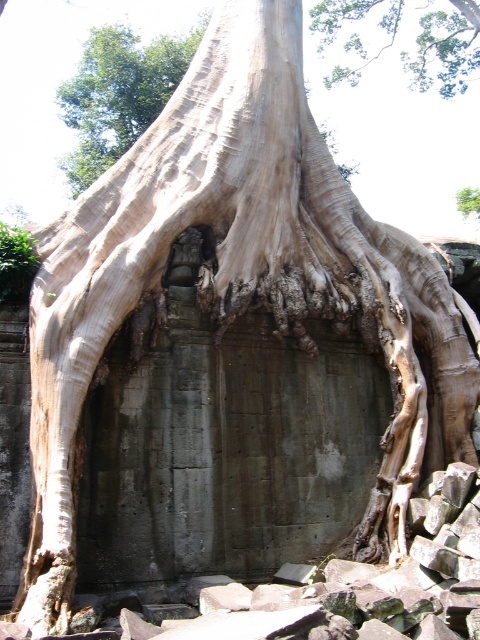
Question: Which of the following is the farthest from the observer?

Choices:
 (A) green leafy tree at upper left
 (B) green leafy tree at upper center

Answer: (B)

Question: Is green leafy tree at upper left smaller than green leafy tree at upper center?

Choices:
 (A) no
 (B) yes

Answer: (A)

Question: Among these points, which one is farthest from the camera?

Choices:
 (A) (144, 81)
 (B) (420, 61)

Answer: (B)

Question: Is green leafy tree at upper left smaller than green leafy tree at upper center?

Choices:
 (A) no
 (B) yes

Answer: (A)

Question: Is green leafy tree at upper left positioned in front of green leafy tree at upper center?

Choices:
 (A) no
 (B) yes

Answer: (B)